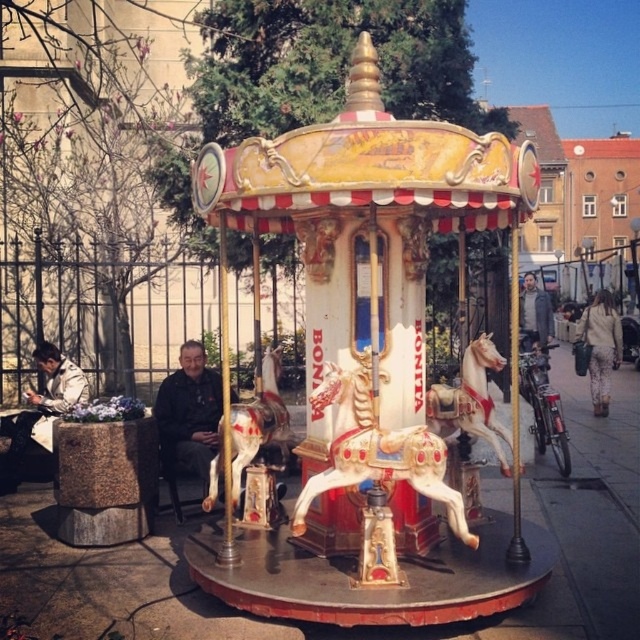
Question: Is painted wood horse at center positioned in front of white glossy horse at center?

Choices:
 (A) no
 (B) yes

Answer: (B)

Question: Is polished wood carousel at center to the right of dark gray jacket at center from the viewer's perspective?

Choices:
 (A) no
 (B) yes

Answer: (A)

Question: Does white glossy horse at center have a greater width compared to white leather jacket at lower left?

Choices:
 (A) no
 (B) yes

Answer: (A)

Question: Estimate the real-world distances between objects in this image. Which object is closer to the white leather jacket at lower left?

Choices:
 (A) floral-patterned pants at lower right
 (B) polished wood carousel at center
 (C) dark brown leather jacket at center

Answer: (C)

Question: Among these objects, which one is farthest from the camera?

Choices:
 (A) dark gray jacket at center
 (B) white leather jacket at lower left

Answer: (A)

Question: Which point appears farthest from the camera in this image?

Choices:
 (A) (355, 177)
 (B) (13, 436)
 (C) (429, 449)
 (D) (609, 323)

Answer: (D)